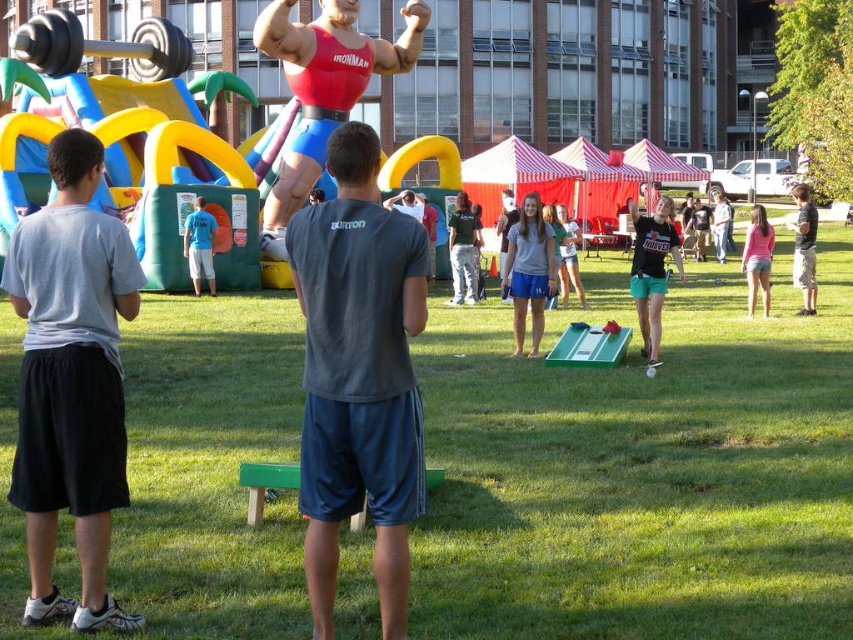
You are a photographer positioned at the center of the field. You need to capture a photo that includes both the gray cotton shirt at center and the pink denim shorts at lower right. What is the minimum distance you must move to ensure both are in frame?

The gray cotton shirt at center and pink denim shorts at lower right are 9.69 meters apart from each other. To include both in the photo, you must move at least half of this distance, approximately 4.85 meters, towards either object to ensure they are within the camera frame.

You are organizing a team event and need to ensure that the black matte shirt at center and the black cotton shirt at right can be distinguished from each other. Based on the scene description, what physical characteristic makes them different?

The black matte shirt at center is larger in size than the black cotton shirt at right.

From the picture: You are standing at the point marked by the coordinates point (x=529, y=269). Looking around, you see the gray cotton shirt at center. Which direction should you walk to reach the dark blue t shirt with BURTON written on the back?

The gray cotton shirt at center is located at point (x=529, y=269). To reach the dark blue t shirt with BURTON written on the back, you should walk towards the right since the dark blue t shirt with BURTON written on the back is positioned to the right of the gray cotton shirt at center.